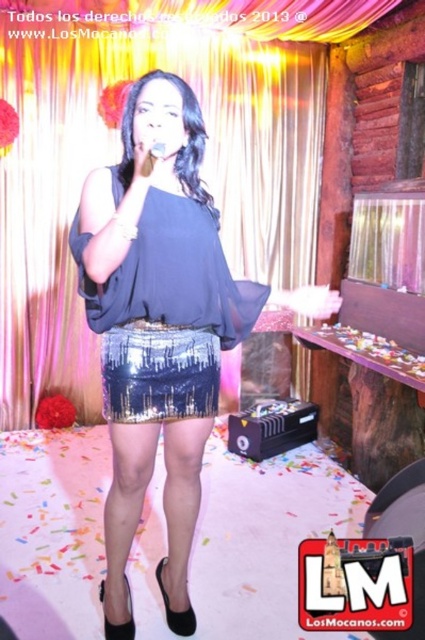
Question: Based on their relative distances, which object is nearer to the matte blue blouse at center?

Choices:
 (A) sparkly sequined skirt at center
 (B) shiny sequined skirt at center
 (C) metallic gold curtain at upper center

Answer: (B)

Question: Which of the following is the farthest from the observer?

Choices:
 (A) [79, 140]
 (B) [184, 611]
 (C) [198, 317]
 (D) [178, 362]

Answer: (A)

Question: Is matte blue blouse at center to the right of shiny sequined skirt at center from the viewer's perspective?

Choices:
 (A) yes
 (B) no

Answer: (A)

Question: Does metallic gold curtain at upper center appear under matte blue blouse at center?

Choices:
 (A) no
 (B) yes

Answer: (A)

Question: Which is nearer to the shiny sequined skirt at center?

Choices:
 (A) metallic gold curtain at upper center
 (B) matte blue blouse at center

Answer: (B)

Question: Can you confirm if matte blue blouse at center is positioned below sparkly sequined skirt at center?

Choices:
 (A) yes
 (B) no

Answer: (A)